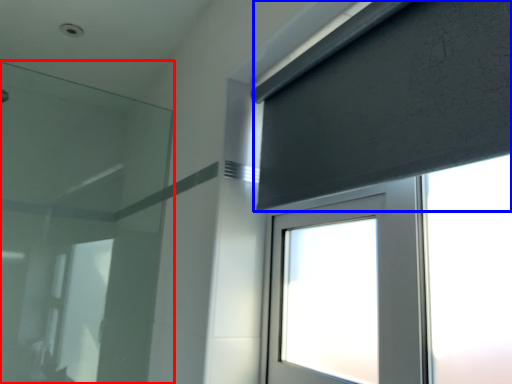
Question: Among these objects, which one is nearest to the camera, filter (highlighted by a red box) or curtain (highlighted by a blue box)?

Choices:
 (A) filter
 (B) curtain

Answer: (B)